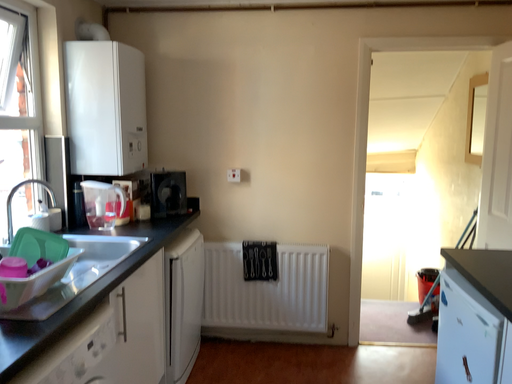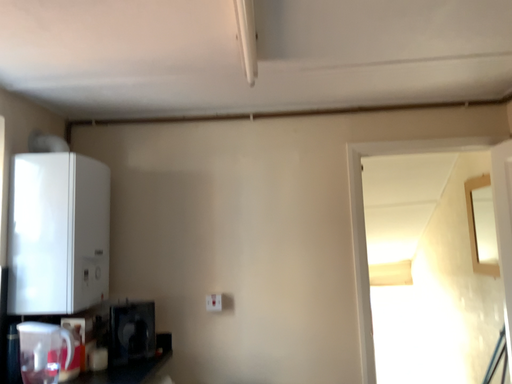
Question: Which way did the camera rotate in the video?

Choices:
 (A) rotated upward
 (B) rotated downward

Answer: (A)